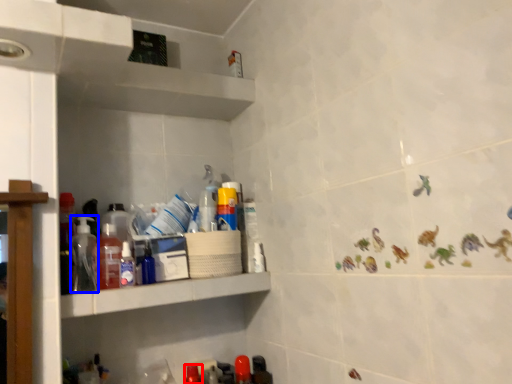
Question: Which object appears closest to the camera in this image, bottle (highlighted by a red box) or bottle (highlighted by a blue box)?

Choices:
 (A) bottle
 (B) bottle

Answer: (B)